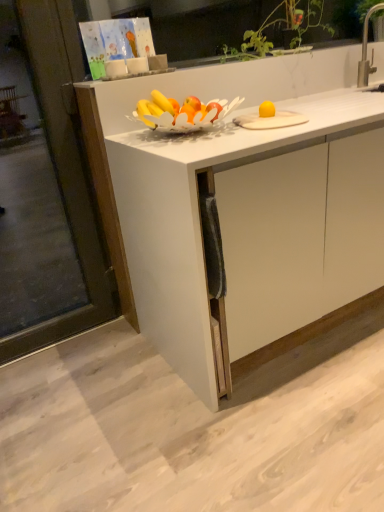
Question: Should I look upward or downward to see silver metallic faucet at upper right?

Choices:
 (A) up
 (B) down

Answer: (A)

Question: From a real-world perspective, is transparent glass screen door at left over silver metallic faucet at upper right?

Choices:
 (A) yes
 (B) no

Answer: (B)

Question: From a real-world perspective, is transparent glass screen door at left positioned under silver metallic faucet at upper right based on gravity?

Choices:
 (A) no
 (B) yes

Answer: (B)

Question: Is transparent glass screen door at left to the left of silver metallic faucet at upper right from the viewer's perspective?

Choices:
 (A) yes
 (B) no

Answer: (A)

Question: Would you consider transparent glass screen door at left to be distant from silver metallic faucet at upper right?

Choices:
 (A) yes
 (B) no

Answer: (A)

Question: Does transparent glass screen door at left come behind silver metallic faucet at upper right?

Choices:
 (A) no
 (B) yes

Answer: (A)

Question: Is transparent glass screen door at left not inside silver metallic faucet at upper right?

Choices:
 (A) yes
 (B) no

Answer: (A)

Question: Can white matte cabinet at center be found inside silver metallic faucet at upper right?

Choices:
 (A) yes
 (B) no

Answer: (B)

Question: From a real-world perspective, is silver metallic faucet at upper right under white matte cabinet at center?

Choices:
 (A) no
 (B) yes

Answer: (A)

Question: Does silver metallic faucet at upper right lie behind white matte cabinet at center?

Choices:
 (A) yes
 (B) no

Answer: (A)

Question: Considering the relative sizes of silver metallic faucet at upper right and white matte cabinet at center in the image provided, is silver metallic faucet at upper right bigger than white matte cabinet at center?

Choices:
 (A) yes
 (B) no

Answer: (B)

Question: Can you confirm if silver metallic faucet at upper right is taller than white matte cabinet at center?

Choices:
 (A) no
 (B) yes

Answer: (A)

Question: Is silver metallic faucet at upper right shorter than white matte cabinet at center?

Choices:
 (A) no
 (B) yes

Answer: (B)

Question: Considering the relative sizes of white matte cabinet at center and silver metallic faucet at upper right in the image provided, is white matte cabinet at center wider than silver metallic faucet at upper right?

Choices:
 (A) no
 (B) yes

Answer: (B)